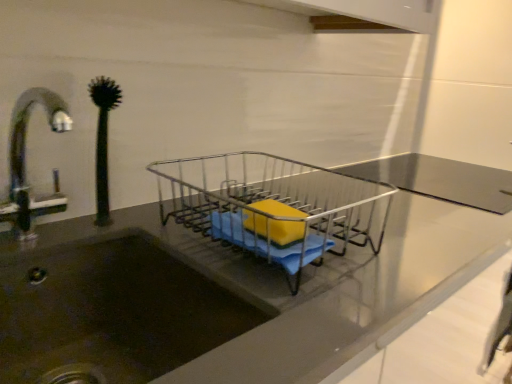
Question: Considering the relative sizes of green rubber plant at left and metallic wire dish rack at center in the image provided, is green rubber plant at left smaller than metallic wire dish rack at center?

Choices:
 (A) yes
 (B) no

Answer: (A)

Question: Is green rubber plant at left outside metallic wire dish rack at center?

Choices:
 (A) yes
 (B) no

Answer: (A)

Question: From the image's perspective, is green rubber plant at left on metallic wire dish rack at center?

Choices:
 (A) no
 (B) yes

Answer: (B)

Question: Is green rubber plant at left wider than metallic wire dish rack at center?

Choices:
 (A) yes
 (B) no

Answer: (B)

Question: Is green rubber plant at left taller than metallic wire dish rack at center?

Choices:
 (A) no
 (B) yes

Answer: (B)

Question: Could you tell me if green rubber plant at left is turned towards metallic wire dish rack at center?

Choices:
 (A) no
 (B) yes

Answer: (A)

Question: From a real-world perspective, is yellow sponge at center positioned over metallic wire dish rack at center based on gravity?

Choices:
 (A) no
 (B) yes

Answer: (B)

Question: Considering the relative sizes of yellow sponge at center and metallic wire dish rack at center in the image provided, is yellow sponge at center smaller than metallic wire dish rack at center?

Choices:
 (A) yes
 (B) no

Answer: (A)

Question: Is yellow sponge at center facing towards metallic wire dish rack at center?

Choices:
 (A) yes
 (B) no

Answer: (A)

Question: Can you see yellow sponge at center touching metallic wire dish rack at center?

Choices:
 (A) yes
 (B) no

Answer: (B)

Question: From a real-world perspective, is yellow sponge at center beneath metallic wire dish rack at center?

Choices:
 (A) yes
 (B) no

Answer: (B)

Question: Does yellow sponge at center appear on the left side of metallic wire dish rack at center?

Choices:
 (A) yes
 (B) no

Answer: (B)

Question: Is metallic wire dish rack at center beside green rubber plant at left?

Choices:
 (A) yes
 (B) no

Answer: (B)